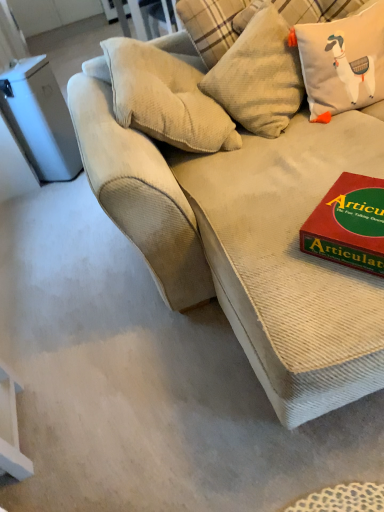
Question: Which direction should I rotate to look at textured beige pillow at upper center, which is the first pillow from left to right?

Choices:
 (A) left
 (B) right

Answer: (B)

Question: Can you confirm if red cardboard game at right is bigger than textured beige pillow at upper center, the 2th pillow when ordered from right to left?

Choices:
 (A) yes
 (B) no

Answer: (B)

Question: Considering the relative sizes of red cardboard game at right and textured beige pillow at upper center, the 2th pillow when ordered from right to left, in the image provided, is red cardboard game at right taller than textured beige pillow at upper center, the 2th pillow when ordered from right to left,?

Choices:
 (A) no
 (B) yes

Answer: (A)

Question: Does red cardboard game at right lie in front of textured beige pillow at upper center, which is the first pillow from left to right?

Choices:
 (A) yes
 (B) no

Answer: (A)

Question: Would you say red cardboard game at right is outside textured beige pillow at upper center, which is the first pillow from left to right?

Choices:
 (A) no
 (B) yes

Answer: (B)

Question: Is red cardboard game at right turned away from textured beige pillow at upper center, the 2th pillow when ordered from right to left?

Choices:
 (A) yes
 (B) no

Answer: (B)

Question: Considering the relative sizes of red cardboard game at right and textured beige pillow at upper center, which is the first pillow from left to right, in the image provided, is red cardboard game at right smaller than textured beige pillow at upper center, which is the first pillow from left to right,?

Choices:
 (A) yes
 (B) no

Answer: (A)

Question: Is beige textured cushion at upper right, which is the 2th pillow from left to right, not near beige corduroy couch at center?

Choices:
 (A) yes
 (B) no

Answer: (B)

Question: Can you confirm if beige textured cushion at upper right, positioned as the first pillow in right-to-left order, is positioned to the right of beige corduroy couch at center?

Choices:
 (A) no
 (B) yes

Answer: (B)

Question: Is beige textured cushion at upper right, which is the 2th pillow from left to right, smaller than beige corduroy couch at center?

Choices:
 (A) yes
 (B) no

Answer: (A)

Question: From the image's perspective, is beige textured cushion at upper right, positioned as the first pillow in right-to-left order, over beige corduroy couch at center?

Choices:
 (A) yes
 (B) no

Answer: (A)

Question: From a real-world perspective, does beige textured cushion at upper right, positioned as the first pillow in right-to-left order, sit lower than beige corduroy couch at center?

Choices:
 (A) yes
 (B) no

Answer: (B)

Question: Does beige textured cushion at upper right, which is the 2th pillow from left to right, have a lesser height compared to beige corduroy couch at center?

Choices:
 (A) yes
 (B) no

Answer: (A)

Question: Is textured beige pillow at upper center, the 2th pillow when ordered from right to left, shorter than red cardboard game at right?

Choices:
 (A) yes
 (B) no

Answer: (B)